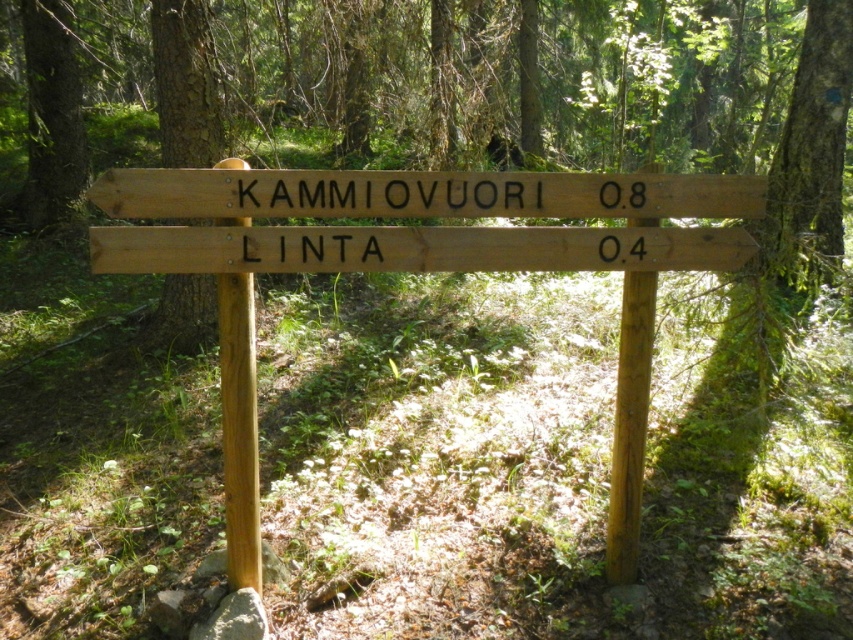
Question: Which of the following is the closest to the observer?

Choices:
 (A) brown rough bark tree at upper left
 (B) brown rough tree trunk at upper left
 (C) wooden signpost at center

Answer: (C)

Question: From the image, what is the correct spatial relationship of wooden signpost at center in relation to brown rough tree trunk at upper left?

Choices:
 (A) right
 (B) left

Answer: (A)

Question: Observing the image, what is the correct spatial positioning of brown rough bark tree at upper left in reference to brown rough tree trunk at upper left?

Choices:
 (A) below
 (B) above

Answer: (A)

Question: Does wooden signpost at center appear on the left side of brown rough bark tree at upper left?

Choices:
 (A) no
 (B) yes

Answer: (A)

Question: Considering the real-world distances, which object is farthest from the wooden signpost at center?

Choices:
 (A) brown rough tree trunk at upper left
 (B) brown rough bark tree at upper left

Answer: (A)

Question: Which object is positioned closest to the brown rough tree trunk at upper left?

Choices:
 (A) brown rough bark tree at upper left
 (B) wooden signpost at center

Answer: (A)